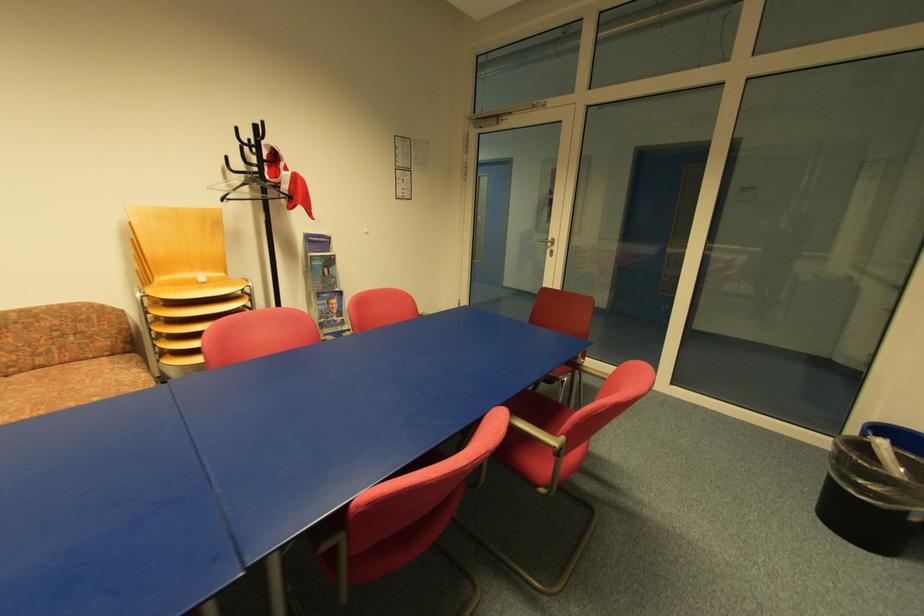
Find the location of a particular element. This screenshot has width=924, height=616. red chair sitting surface is located at coordinates (538, 440).